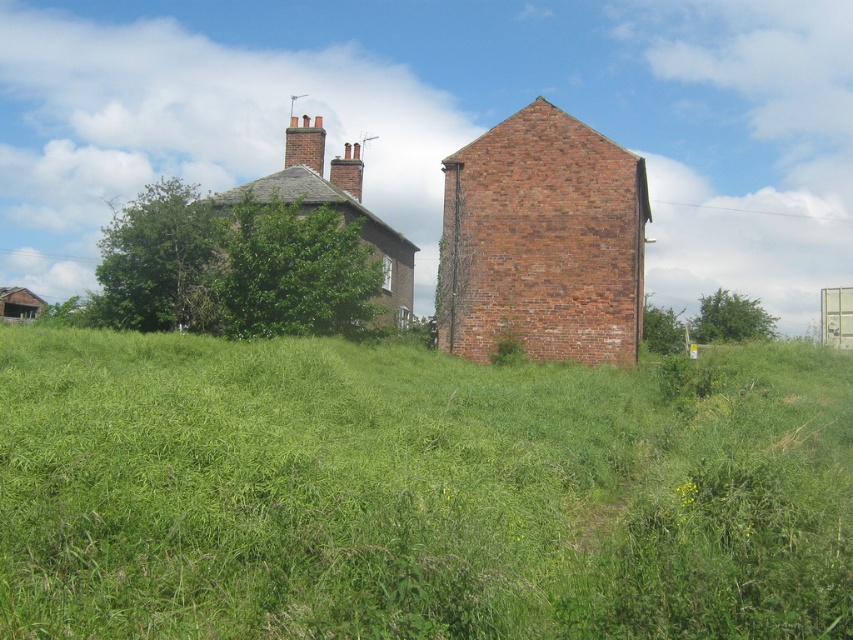
You are a gardener planning to plant a new flower bed. You need to choose between the green grass at center and the area near the red brick chimney at upper center. Which location has more space for planting?

The green grass at center has more space for planting because it is bigger than the red brick chimney at upper center.